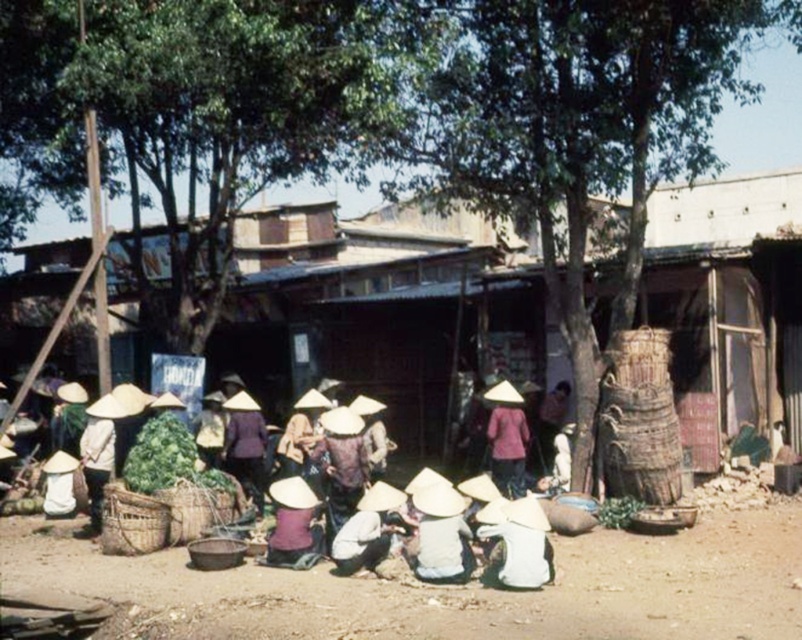
Is white straw hat at lower center wider than matte white hat at center?

In fact, white straw hat at lower center might be narrower than matte white hat at center.

How far apart are white straw hat at lower center and matte white hat at center?

white straw hat at lower center and matte white hat at center are 4.55 feet apart.

Who is more forward, (513,572) or (342,572)?

Positioned in front is point (513,572).

Find the location of a particular element. This screenshot has height=640, width=802. white straw hat at lower center is located at coordinates (x=517, y=545).

Which of these two, brown dirt field at lower center or white straw hat at lower center, stands taller?

white straw hat at lower center

Describe the element at coordinates (456, 588) in the screenshot. The width and height of the screenshot is (802, 640). I see `brown dirt field at lower center` at that location.

Is point (349, 579) positioned behind point (519, 509)?

Yes, point (349, 579) is farther from viewer.

The height and width of the screenshot is (640, 802). What are the coordinates of `brown dirt field at lower center` in the screenshot? It's located at (456, 588).

Does white straw hat at lower center have a greater width compared to white matte hat at center?

Indeed, white straw hat at lower center has a greater width compared to white matte hat at center.

Can you confirm if white straw hat at lower center is taller than white matte hat at center?

In fact, white straw hat at lower center may be shorter than white matte hat at center.

Does point (497, 538) come behind point (452, 580)?

Yes, point (497, 538) is farther from viewer.

Identify the location of white straw hat at lower center. (517, 545).